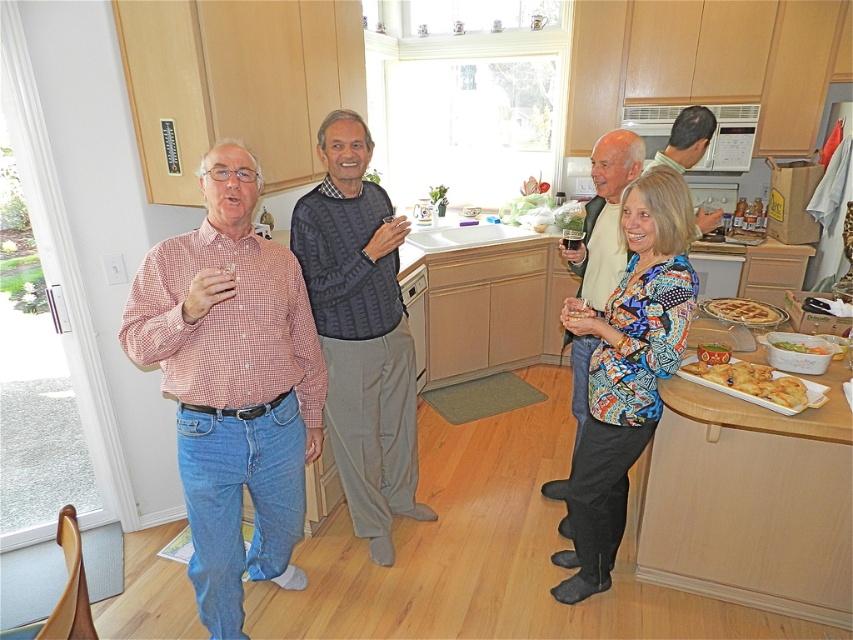
Question: Which point is closer to the camera?

Choices:
 (A) gray sweater at center
 (B) golden crispy pastry at lower right
 (C) knitted sweater at center
 (D) golden crispy waffle at center

Answer: (B)

Question: Which object is positioned closest to the checkered cotton shirt at left?

Choices:
 (A) white glossy dishwasher at center
 (B) clear plastic cup at center
 (C) green leafy salad at lower right
 (D) knitted sweater at center

Answer: (D)

Question: Which point is closer to the camera?

Choices:
 (A) (624, 294)
 (B) (728, 384)
 (C) (569, 248)

Answer: (A)

Question: Can you confirm if gray sweater at center is bigger than golden crispy waffle at center?

Choices:
 (A) yes
 (B) no

Answer: (A)

Question: Does gray sweater at center have a lesser width compared to golden crispy waffle at center?

Choices:
 (A) yes
 (B) no

Answer: (A)

Question: Is white glossy dishwasher at center smaller than golden crispy waffle at center?

Choices:
 (A) no
 (B) yes

Answer: (A)